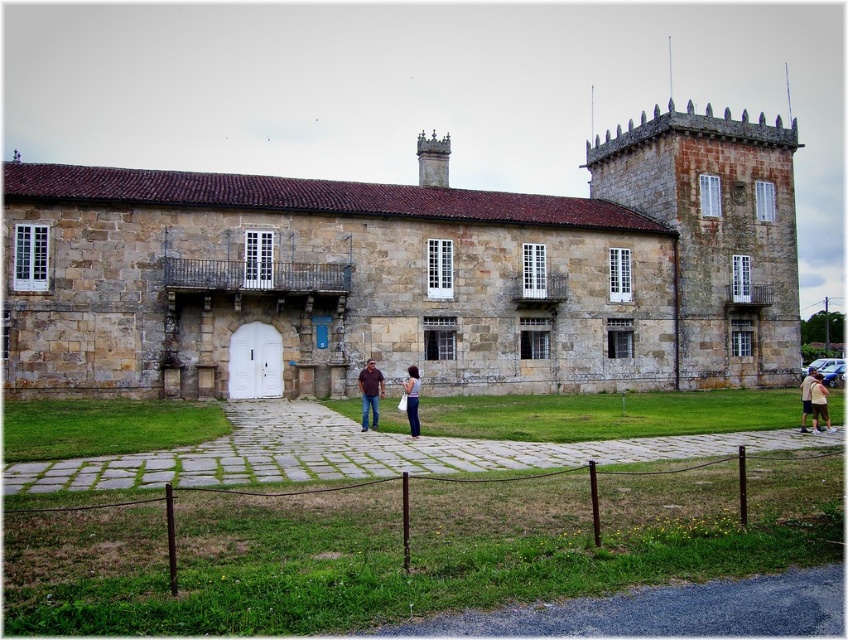
Can you confirm if matte brown stone couple at center is positioned to the left of brown leather jacket at center?

In fact, matte brown stone couple at center is to the right of brown leather jacket at center.

Can you confirm if matte brown stone couple at center is thinner than brown leather jacket at center?

In fact, matte brown stone couple at center might be wider than brown leather jacket at center.

Which is in front, point (360, 381) or point (365, 371)?

Point (365, 371)

I want to click on matte brown stone couple at center, so [x=371, y=392].

Is matte brown stone couple at center smaller than denim pants at center?

Incorrect, matte brown stone couple at center is not smaller in size than denim pants at center.

Which is in front, point (416, 381) or point (406, 381)?

Point (416, 381) is in front.

Who is more distant from viewer, (382, 385) or (409, 422)?

The point (382, 385) is more distant.

Locate an element on the screen. This screenshot has width=848, height=640. matte brown stone couple at center is located at coordinates (371, 392).

Does matte brown stone couple at center appear over light brown shirt at center?

Yes.

Does matte brown stone couple at center appear under light brown shirt at center?

No.

Which is in front, point (372, 372) or point (804, 429)?

Point (804, 429)

I want to click on matte brown stone couple at center, so click(371, 392).